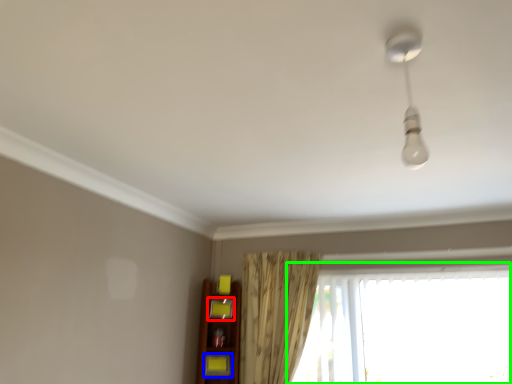
Question: Considering the real-world distances, which object is farthest from shelf (highlighted by a red box)? shelf (highlighted by a blue box) or window (highlighted by a green box)?

Choices:
 (A) shelf
 (B) window

Answer: (B)